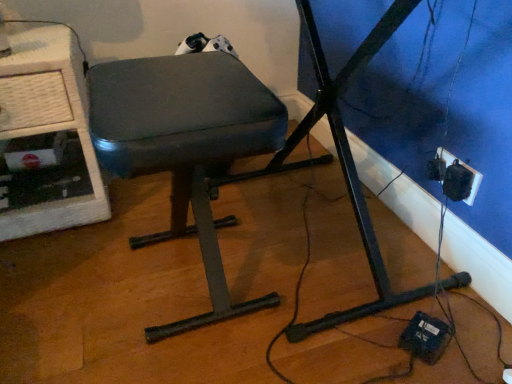
Locate an element on the screen. The width and height of the screenshot is (512, 384). matte black stool at center is located at coordinates (185, 146).

Does matte black stool at center touch black plastic socket at lower right?

There is a gap between matte black stool at center and black plastic socket at lower right.

Measure the distance between matte black stool at center and black plastic socket at lower right.

A distance of 26.52 inches exists between matte black stool at center and black plastic socket at lower right.

Looking at this image, which is behind, matte black stool at center or black plastic socket at lower right?

black plastic socket at lower right is more distant.

Is matte black stool at center thinner than black plastic socket at lower right?

In fact, matte black stool at center might be wider than black plastic socket at lower right.

Which is closer to the camera, (21, 77) or (445, 156)?

Point (21, 77).

Can you tell me how much white textured computer desk at left and black plastic socket at lower right differ in facing direction?

89.2 degrees.

In terms of width, does white textured computer desk at left look wider or thinner when compared to black plastic socket at lower right?

white textured computer desk at left is wider than black plastic socket at lower right.

Based on their positions, is white textured computer desk at left located to the left or right of black plastic socket at lower right?

white textured computer desk at left is to the left of black plastic socket at lower right.

Are black plastic socket at lower right and matte black stool at center making contact?

black plastic socket at lower right and matte black stool at center are clearly separated.

Considering their positions, is black plastic socket at lower right located in front of or behind matte black stool at center?

Visually, black plastic socket at lower right is located behind matte black stool at center.

Considering the relative sizes of black plastic socket at lower right and matte black stool at center in the image provided, is black plastic socket at lower right smaller than matte black stool at center?

Indeed, black plastic socket at lower right has a smaller size compared to matte black stool at center.

Is black plastic socket at lower right at the right side of matte black stool at center?

Indeed, black plastic socket at lower right is positioned on the right side of matte black stool at center.

Based on the photo, can you tell me how much white textured computer desk at left and matte black stool at center differ in facing direction?

The angular difference between white textured computer desk at left and matte black stool at center is 90.7 degrees.

Which of these two, white textured computer desk at left or matte black stool at center, is smaller?

matte black stool at center.

Does point (10, 44) appear closer or farther from the camera than point (270, 116)?

Point (10, 44) is positioned farther from the camera compared to point (270, 116).

Which object is wider, white textured computer desk at left or matte black stool at center?

white textured computer desk at left.

From the image's perspective, is matte black stool at center positioned above or below white textured computer desk at left?

matte black stool at center is below white textured computer desk at left.

Is matte black stool at center in contact with white textured computer desk at left?

No.

Is white textured computer desk at left completely or partially inside matte black stool at center?

Definitely not — white textured computer desk at left is not inside matte black stool at center.

From the picture: Based on their sizes in the image, would you say black plastic socket at lower right is bigger or smaller than white textured computer desk at left?

black plastic socket at lower right is smaller than white textured computer desk at left.

In the scene shown: Considering the sizes of black plastic socket at lower right and white textured computer desk at left in the image, is black plastic socket at lower right taller or shorter than white textured computer desk at left?

black plastic socket at lower right is shorter than white textured computer desk at left.

In the scene shown: From a real-world perspective, is black plastic socket at lower right under white textured computer desk at left?

Correct, in the physical world, black plastic socket at lower right is lower than white textured computer desk at left.

Between black plastic socket at lower right and white textured computer desk at left, which one has larger width?

white textured computer desk at left is wider.

Find the location of a particular element. furniture lying on the left of black plastic socket at lower right is located at coordinates (185, 146).

Where is `electric outlet on the right of the white textured computer desk at left`? This screenshot has width=512, height=384. electric outlet on the right of the white textured computer desk at left is located at coordinates point(472,183).

Estimate the real-world distances between objects in this image. Which object is further from white textured computer desk at left, black plastic socket at lower right or matte black stool at center?

black plastic socket at lower right lies further to white textured computer desk at left than the other object.

From the image, which object appears to be farther from black plastic socket at lower right, white textured computer desk at left or matte black stool at center?

white textured computer desk at left is further to black plastic socket at lower right.

Considering their positions, is white textured computer desk at left positioned further to matte black stool at center than black plastic socket at lower right?

The object further to matte black stool at center is black plastic socket at lower right.

From the image, which object appears to be farther from white textured computer desk at left, matte black stool at center or black plastic socket at lower right?

black plastic socket at lower right is further to white textured computer desk at left.

Looking at the image, which one is located closer to matte black stool at center, black plastic socket at lower right or white textured computer desk at left?

white textured computer desk at left is closer to matte black stool at center.

Which object lies nearer to the anchor point black plastic socket at lower right, matte black stool at center or white textured computer desk at left?

matte black stool at center.

I want to click on furniture located between white textured computer desk at left and black plastic socket at lower right in the left-right direction, so click(185, 146).